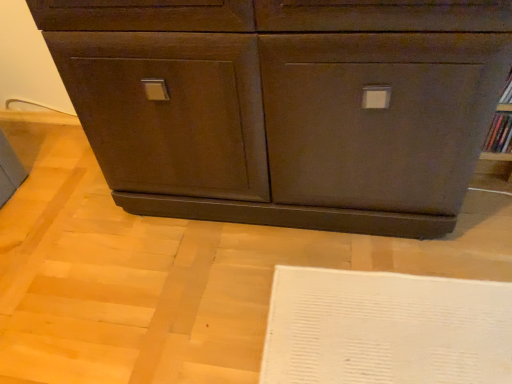
The image size is (512, 384). Find the location of `dark wood cabinet at center`. dark wood cabinet at center is located at coordinates (285, 105).

This screenshot has height=384, width=512. What do you see at coordinates (285, 105) in the screenshot?
I see `dark wood cabinet at center` at bounding box center [285, 105].

At what (x,y) coordinates should I click in order to perform the action: click on dark wood cabinet at center. Please return your answer as a coordinate pair (x, y). The width and height of the screenshot is (512, 384). Looking at the image, I should click on (285, 105).